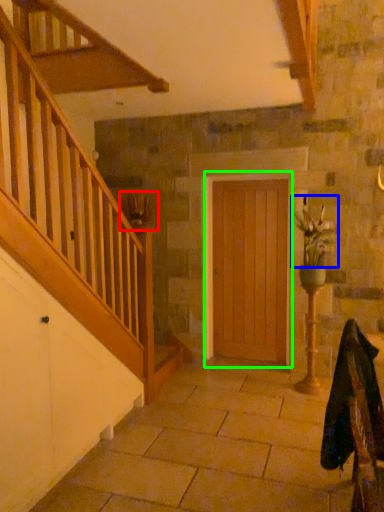
Question: Considering the real-world distances, which object is farthest from plant (highlighted by a red box)? floral arrangement (highlighted by a blue box) or door (highlighted by a green box)?

Choices:
 (A) floral arrangement
 (B) door

Answer: (A)